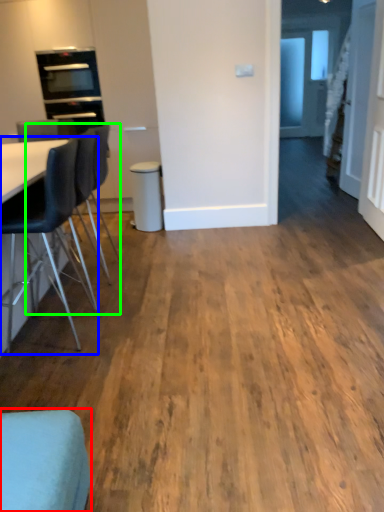
Question: Which object is the closest to the chair (highlighted by a red box)? Choose among these: chair (highlighted by a blue box) or chair (highlighted by a green box).

Choices:
 (A) chair
 (B) chair

Answer: (A)